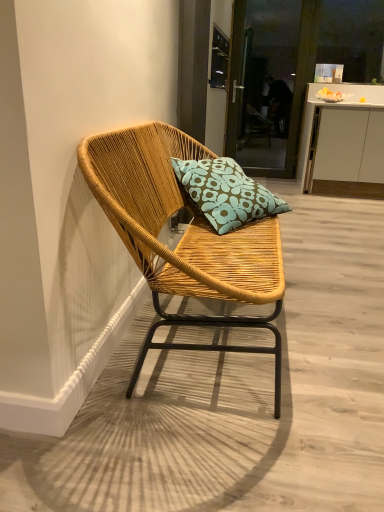
Question: Is transparent glass screen door at upper center turned away from woven wood chair at center?

Choices:
 (A) yes
 (B) no

Answer: (B)

Question: Is transparent glass screen door at upper center bigger than woven wood chair at center?

Choices:
 (A) no
 (B) yes

Answer: (A)

Question: Does transparent glass screen door at upper center come in front of woven wood chair at center?

Choices:
 (A) yes
 (B) no

Answer: (B)

Question: From a real-world perspective, is transparent glass screen door at upper center over woven wood chair at center?

Choices:
 (A) yes
 (B) no

Answer: (A)

Question: Would you say transparent glass screen door at upper center is a long distance from woven wood chair at center?

Choices:
 (A) no
 (B) yes

Answer: (B)

Question: Can you confirm if transparent glass screen door at upper center is thinner than woven wood chair at center?

Choices:
 (A) yes
 (B) no

Answer: (A)

Question: Is white matte cabinet at center to the right of woven wood chair at center from the viewer's perspective?

Choices:
 (A) no
 (B) yes

Answer: (B)

Question: Can woven wood chair at center be found inside white matte cabinet at center?

Choices:
 (A) no
 (B) yes

Answer: (A)

Question: Is white matte cabinet at center taller than woven wood chair at center?

Choices:
 (A) no
 (B) yes

Answer: (B)

Question: Does white matte cabinet at center turn towards woven wood chair at center?

Choices:
 (A) yes
 (B) no

Answer: (A)

Question: Does white matte cabinet at center appear on the left side of woven wood chair at center?

Choices:
 (A) no
 (B) yes

Answer: (A)

Question: Is white matte cabinet at center far away from woven wood chair at center?

Choices:
 (A) yes
 (B) no

Answer: (A)

Question: Would you consider teal floral cushion at center to be distant from woven wood chair at center?

Choices:
 (A) yes
 (B) no

Answer: (B)